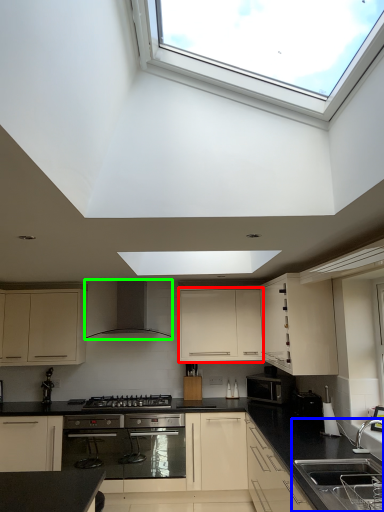
Question: Based on their relative distances, which object is farther from cabinetry (highlighted by a red box)? Choose from sink (highlighted by a blue box) and kitchen appliance (highlighted by a green box).

Choices:
 (A) sink
 (B) kitchen appliance

Answer: (A)